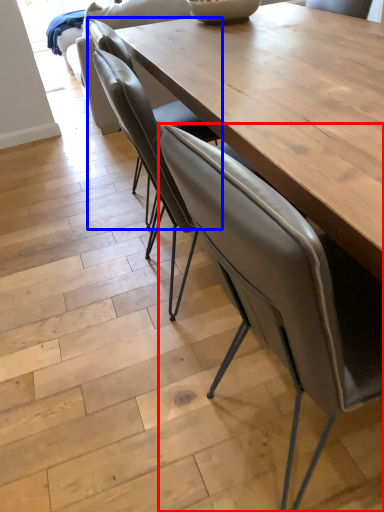
Question: Among these objects, which one is farthest to the camera, chair (highlighted by a red box) or chair (highlighted by a blue box)?

Choices:
 (A) chair
 (B) chair

Answer: (B)